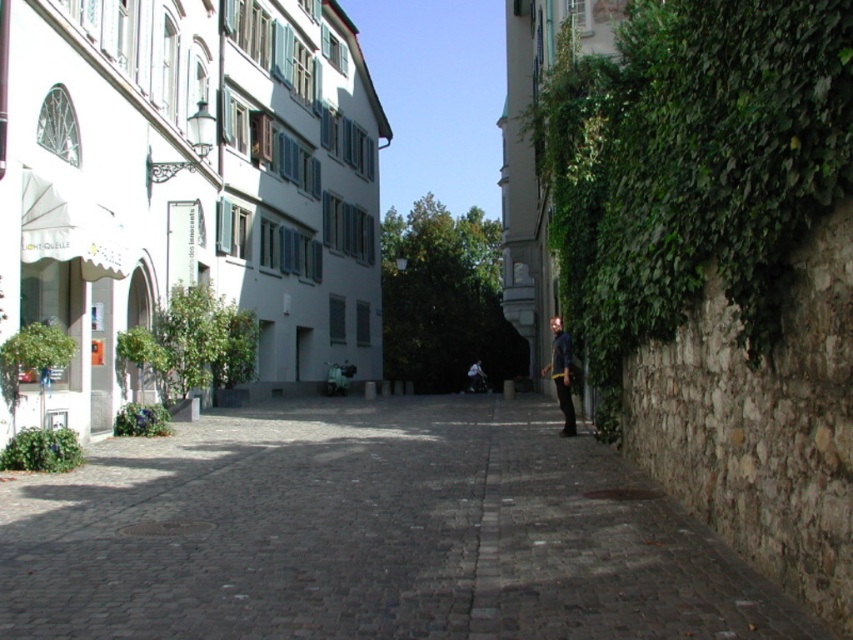
From the picture: You are a tourist visiting this European city and you want to place your dark blue denim jacket at right on the dark gray cobblestone at center. Based on the space available, will the jacket fit entirely on the cobblestone?

The dark gray cobblestone at center occupies less space than the dark blue denim jacket at right, so the jacket will not fit entirely on the cobblestone.